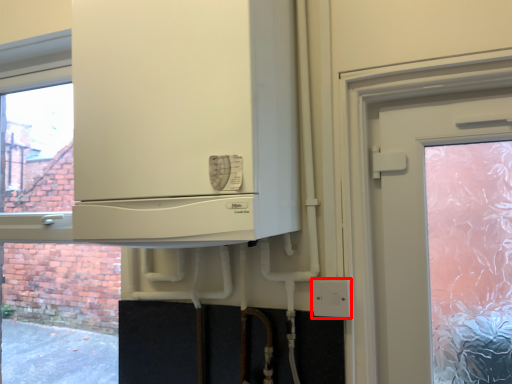
Question: From the image's perspective, where is electric outlet (annotated by the red box) located relative to cabinetry?

Choices:
 (A) below
 (B) above

Answer: (A)